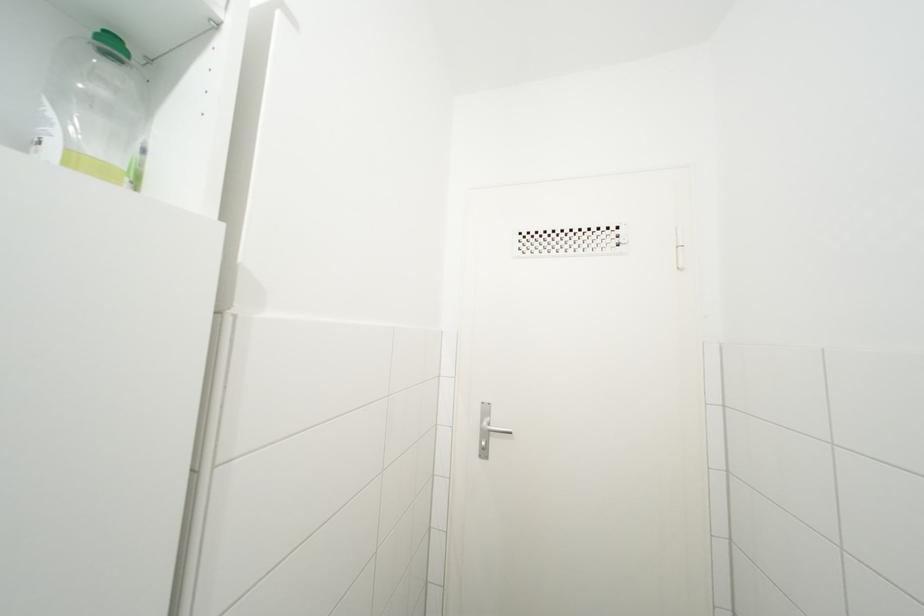
I want to click on green bottle cap, so click(111, 41).